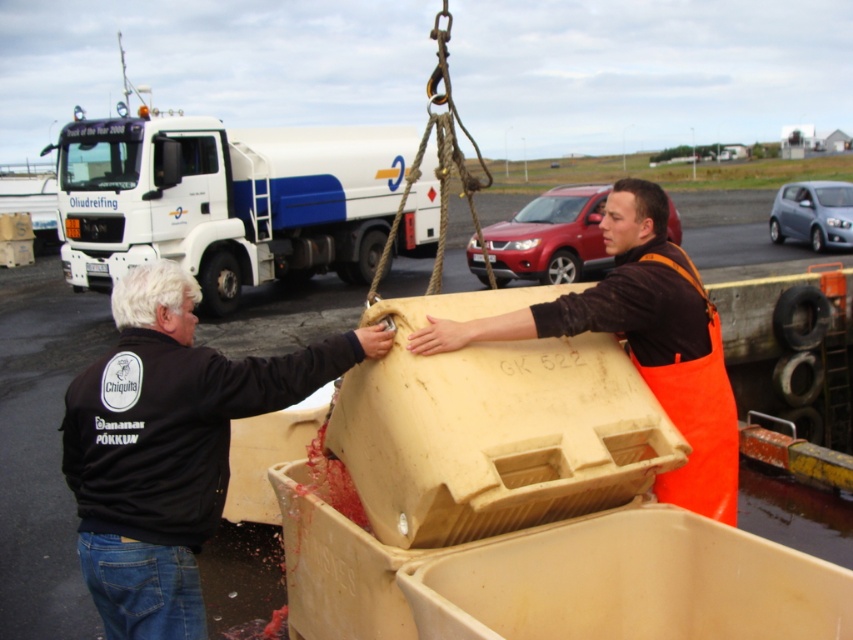
Question: Where is black fabric jacket at left located in relation to orange apron at center in the image?

Choices:
 (A) left
 (B) right

Answer: (A)

Question: Considering the real-world distances, which object is farthest from the white glossy truck at upper left?

Choices:
 (A) black fabric jacket at left
 (B) orange apron at center

Answer: (B)

Question: Which is nearer to the white glossy truck at upper left?

Choices:
 (A) black fabric jacket at left
 (B) orange apron at center

Answer: (A)

Question: From the image, what is the correct spatial relationship of white glossy truck at upper left in relation to orange apron at center?

Choices:
 (A) above
 (B) below

Answer: (A)

Question: Can you confirm if white glossy truck at upper left is thinner than black fabric jacket at left?

Choices:
 (A) yes
 (B) no

Answer: (A)

Question: Which object appears closest to the camera in this image?

Choices:
 (A) orange apron at center
 (B) white glossy truck at upper left
 (C) black fabric jacket at left

Answer: (C)